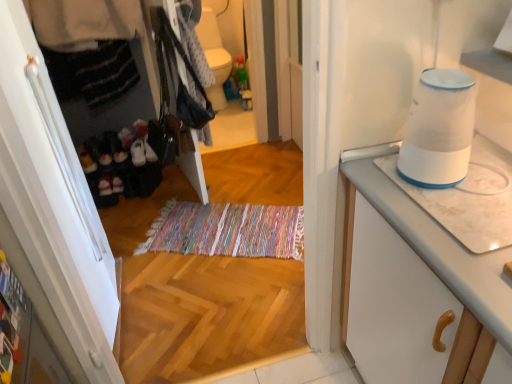
What are the coordinates of `free space to the back side of white matte cabinet at left` in the screenshot? It's located at point(152,241).